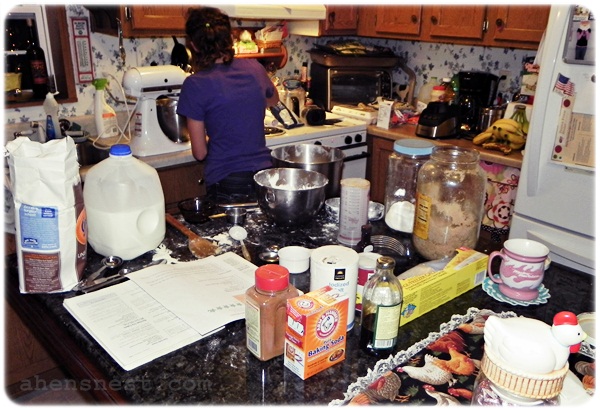
The width and height of the screenshot is (600, 410). Identify the location of wallpaper. (443, 52).